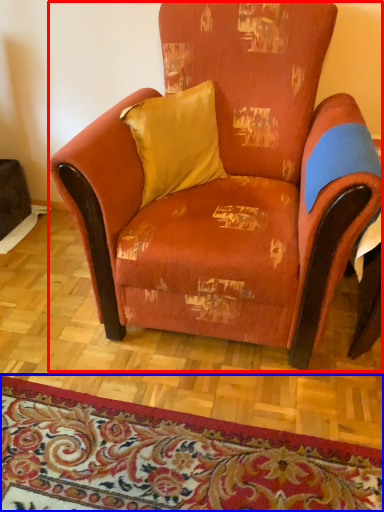
Question: Among these objects, which one is farthest to the camera, chair (highlighted by a red box) or mat (highlighted by a blue box)?

Choices:
 (A) chair
 (B) mat

Answer: (B)